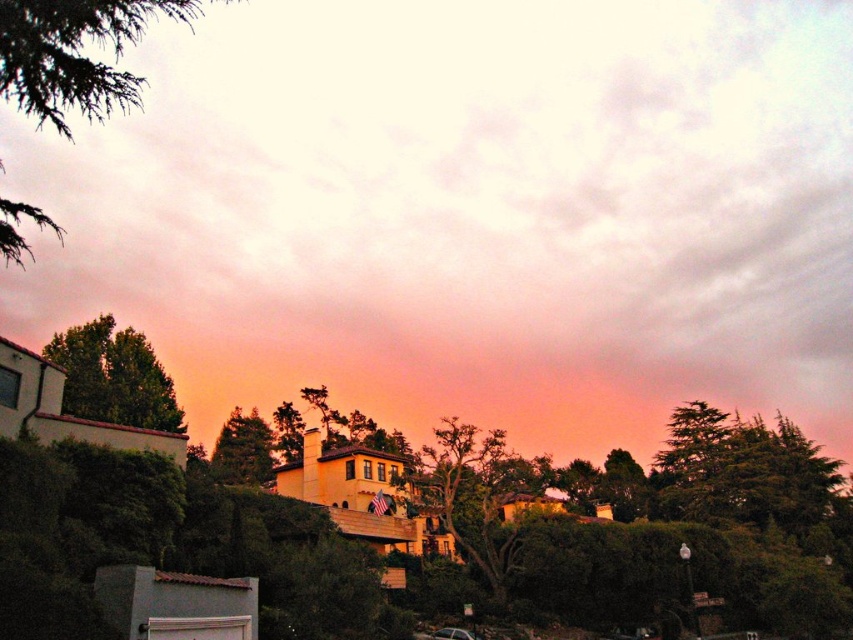
Question: Which object appears closest to the camera in this image?

Choices:
 (A) pink matte cloud at upper center
 (B) green matte tree at center
 (C) green leafy tree at left
 (D) green leafy tree at upper left

Answer: (D)

Question: Is pink matte cloud at upper center positioned at the back of green leafy tree at upper left?

Choices:
 (A) yes
 (B) no

Answer: (A)

Question: Is pink matte cloud at upper center above green matte tree at center?

Choices:
 (A) no
 (B) yes

Answer: (B)

Question: Which object appears farthest from the camera in this image?

Choices:
 (A) green leafy tree at upper left
 (B) green leafy tree at left

Answer: (B)

Question: Does pink matte cloud at upper center come behind green leafy tree at upper left?

Choices:
 (A) yes
 (B) no

Answer: (A)

Question: Which object appears closest to the camera in this image?

Choices:
 (A) green leafy tree at upper left
 (B) pink matte cloud at upper center
 (C) green matte tree at center
 (D) green leafy tree at left

Answer: (A)